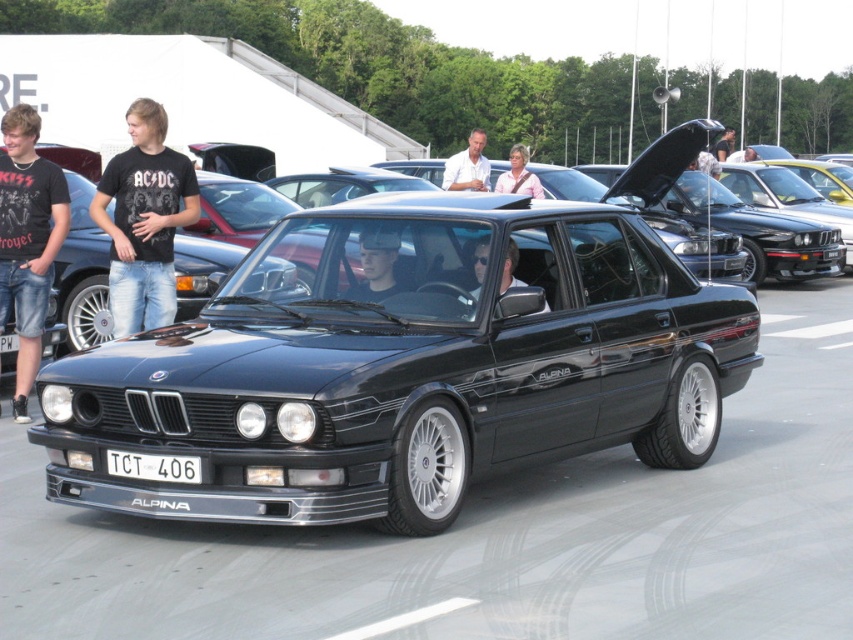
Question: Does black cotton t-shirt at left appear under matte black helmet at center?

Choices:
 (A) yes
 (B) no

Answer: (B)

Question: Is black metallic sedan at center to the left of black t-shirt at left from the viewer's perspective?

Choices:
 (A) no
 (B) yes

Answer: (A)

Question: Estimate the real-world distances between objects in this image. Which object is farther from the black metallic sedan at center?

Choices:
 (A) white plastic license plate at center
 (B) light brown leather jacket at center

Answer: (B)

Question: Based on their relative distances, which object is farther from the black t-shirt at left?

Choices:
 (A) pink fabric shirt at center
 (B) white plastic license plate at center
 (C) light brown leather jacket at center

Answer: (C)

Question: Is matte black helmet at center smaller than white shirt at center?

Choices:
 (A) yes
 (B) no

Answer: (A)

Question: Which of the following is the farthest from the observer?

Choices:
 (A) (722, 157)
 (B) (107, 451)
 (C) (360, 292)
 (D) (527, 160)

Answer: (A)